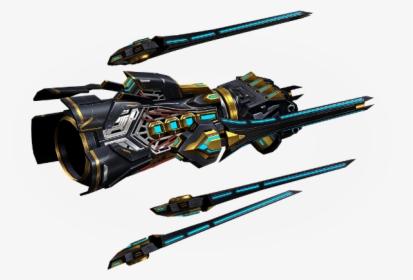
I want to click on grey plate, so click(x=99, y=112).